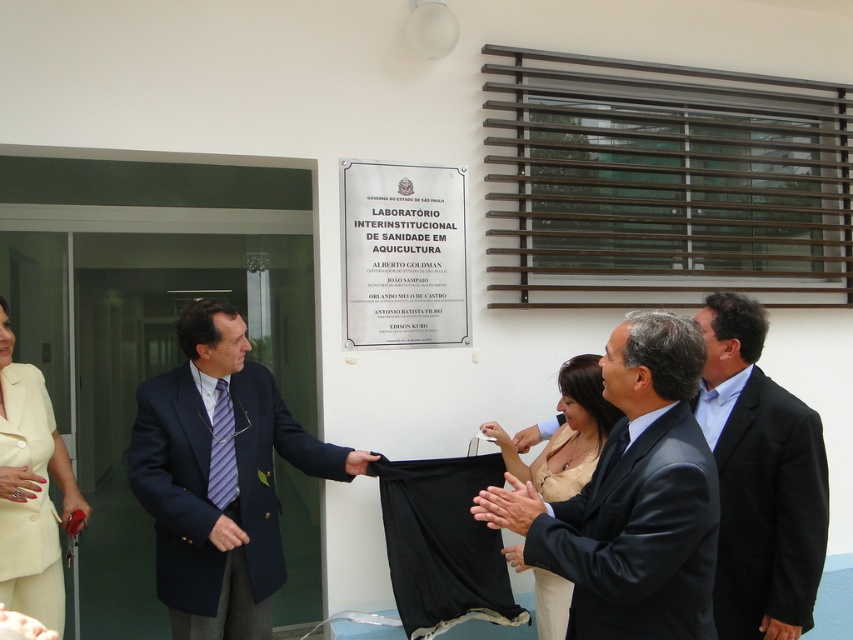
Looking at this image, you are a photographer at the event and need to capture a photo of the dark gray suit at center and the smooth skin hand at center in the same frame. The camera has a minimum focus distance of 1 meter. Can you take the photo without moving either subject?

The dark gray suit at center and smooth skin hand at center are 1.13 meters apart from each other. Since the camera requires at least 1 meter between subjects for focus, the 1.13 meters distance is sufficient. Yes, you can take the photo without moving either subject.

You are organizing a formal event and need to ensure that all attire details are properly noted. Which item is larger in size between the dark gray suit at center and the purple striped tie at center?

The dark gray suit at center is bigger than the purple striped tie at center.